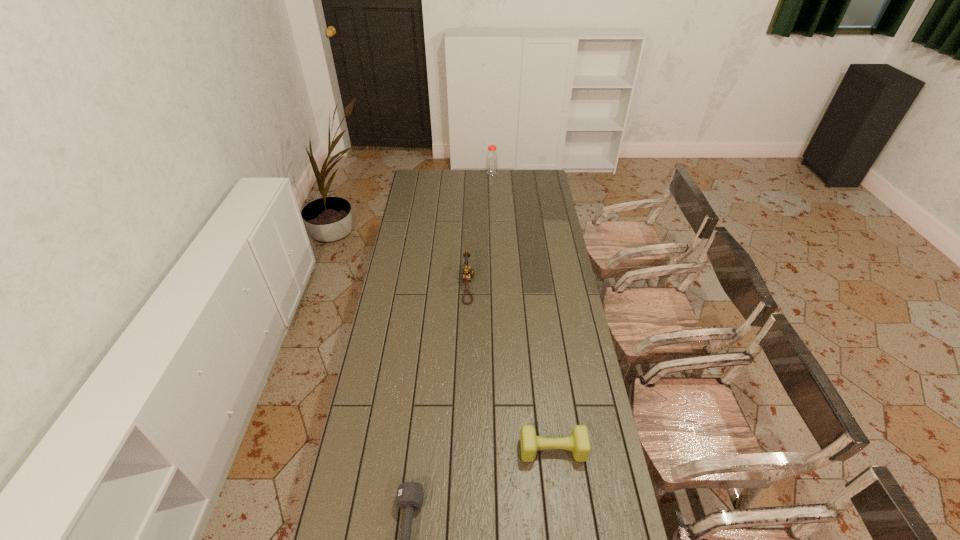
Where is `the tallest object`? the tallest object is located at coordinates (491, 158).

Where is `bottle`? This screenshot has height=540, width=960. bottle is located at coordinates (491, 158).

Locate an element on the screen. telephone is located at coordinates (467, 271).

I want to click on the second tallest object, so click(467, 271).

The height and width of the screenshot is (540, 960). In order to click on the second nearest object in this screenshot , I will do `click(579, 443)`.

Where is `the farther dumbbell`? the farther dumbbell is located at coordinates (579, 443).

Image resolution: width=960 pixels, height=540 pixels. Find the location of `vacant area situated on the front of the second object from right to left`. vacant area situated on the front of the second object from right to left is located at coordinates (493, 208).

Where is `vacant region located on the front-facing side of the telephone`? vacant region located on the front-facing side of the telephone is located at coordinates (537, 285).

The image size is (960, 540). In order to click on blank space located 0.330m on the back of the taller dumbbell in this screenshot , I will do [x=541, y=359].

Locate an element on the screen. The width and height of the screenshot is (960, 540). object situated at the far edge is located at coordinates (491, 158).